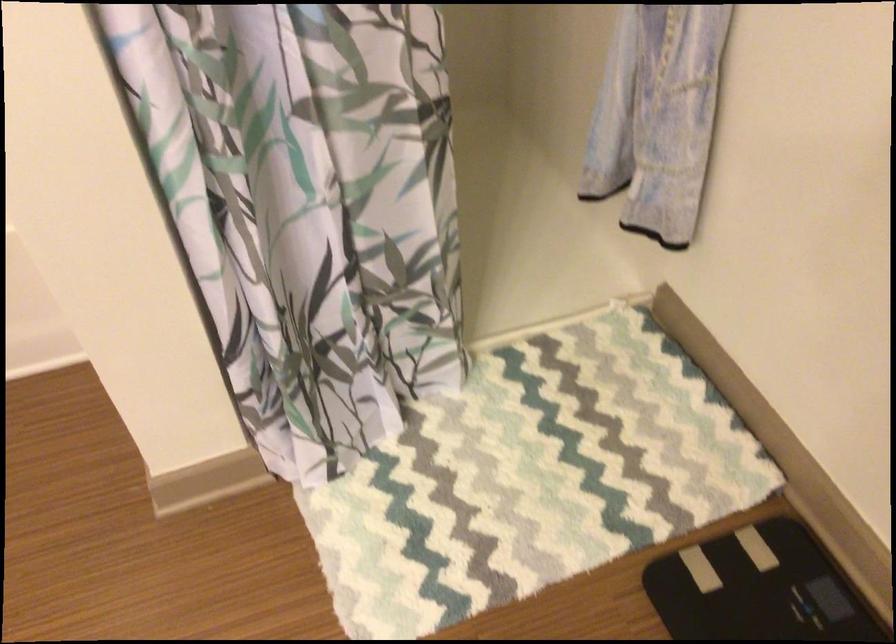
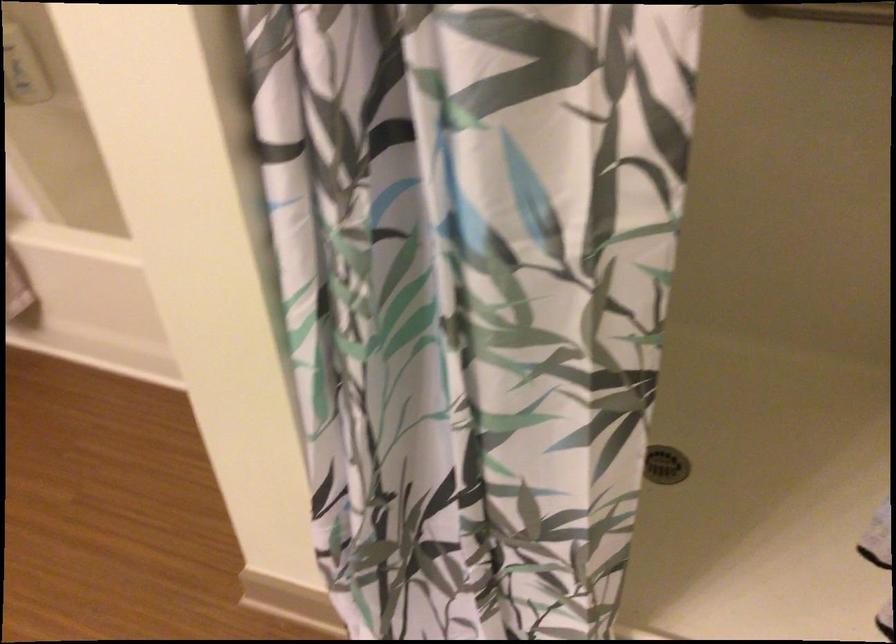
Question: The camera is either moving clockwise (left) or counter-clockwise (right) around the object. The first image is from the beginning of the video and the second image is from the end. Is the camera moving left or right when shooting the video?

Choices:
 (A) Left
 (B) Right

Answer: (B)